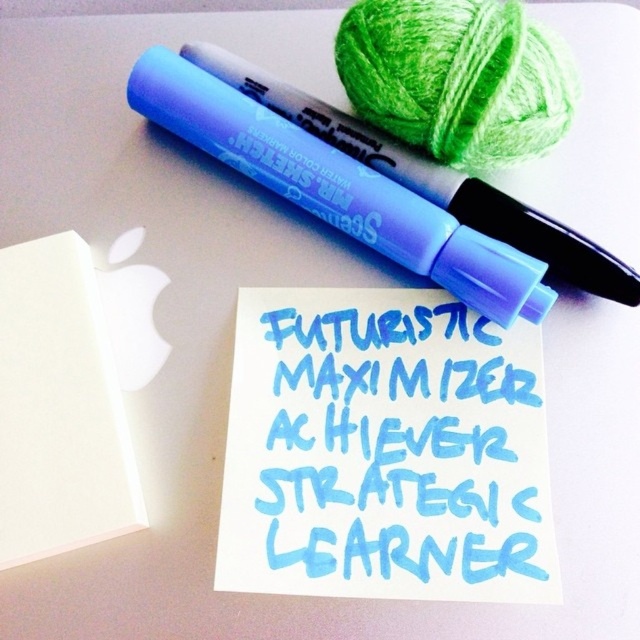
Question: Which object is the farthest from the blue watercolor text at center?

Choices:
 (A) white matte notepad at lower left
 (B) matte blue marker at upper center

Answer: (A)

Question: Can you confirm if white matte notepad at lower left is thinner than matte blue marker at upper center?

Choices:
 (A) no
 (B) yes

Answer: (B)

Question: Is white matte notepad at lower left wider than matte blue marker at upper center?

Choices:
 (A) yes
 (B) no

Answer: (B)

Question: Which point is farther to the camera?

Choices:
 (A) (436, 570)
 (B) (616, 285)

Answer: (B)

Question: Considering the relative positions of blue watercolor text at center and matte blue marker at upper center in the image provided, where is blue watercolor text at center located with respect to matte blue marker at upper center?

Choices:
 (A) left
 (B) right

Answer: (A)

Question: Which of the following is the farthest from the observer?

Choices:
 (A) blue watercolor text at center
 (B) white matte notepad at lower left

Answer: (A)